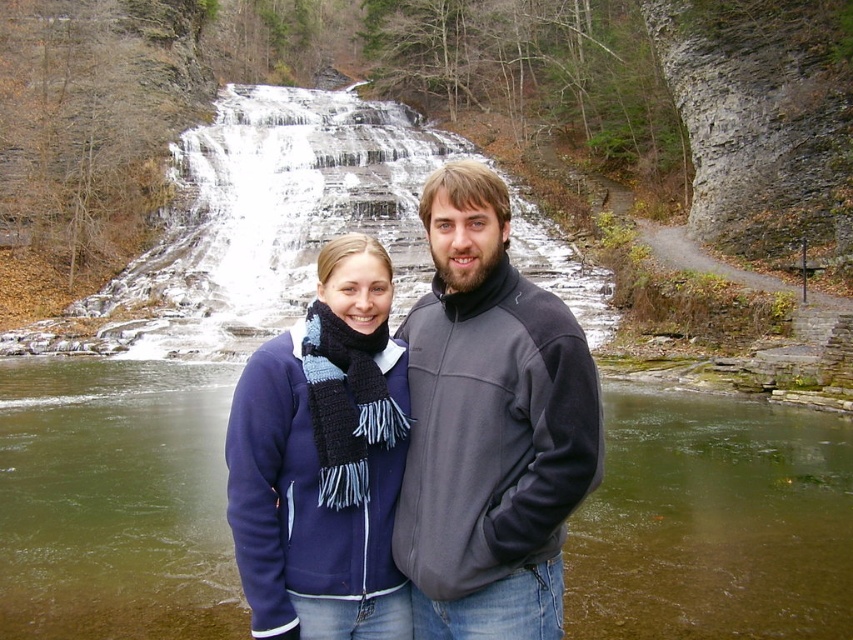
Is point (216, 492) positioned in front of point (503, 467)?

No, (216, 492) is further to viewer.

Is green water at center further to camera compared to gray fleece jacket at center?

Yes, it is.

Is point (213, 422) in front of point (445, 385)?

No, it is not.

At what (x,y) coordinates should I click in order to perform the action: click on green water at center. Please return your answer as a coordinate pair (x, y). The height and width of the screenshot is (640, 853). Looking at the image, I should click on (714, 524).

Describe the element at coordinates (489, 426) in the screenshot. I see `gray fleece jacket at center` at that location.

Is gray fleece jacket at center positioned before blue knitted scarf at center?

No.

Identify the location of gray fleece jacket at center. (489, 426).

The image size is (853, 640). What do you see at coordinates (714, 524) in the screenshot?
I see `green water at center` at bounding box center [714, 524].

Can you confirm if green water at center is taller than blue knitted scarf at center?

No, green water at center is not taller than blue knitted scarf at center.

Between point (16, 602) and point (355, 541), which one is positioned in front?

Point (355, 541) is more forward.

Locate an element on the screen. This screenshot has width=853, height=640. green water at center is located at coordinates (714, 524).